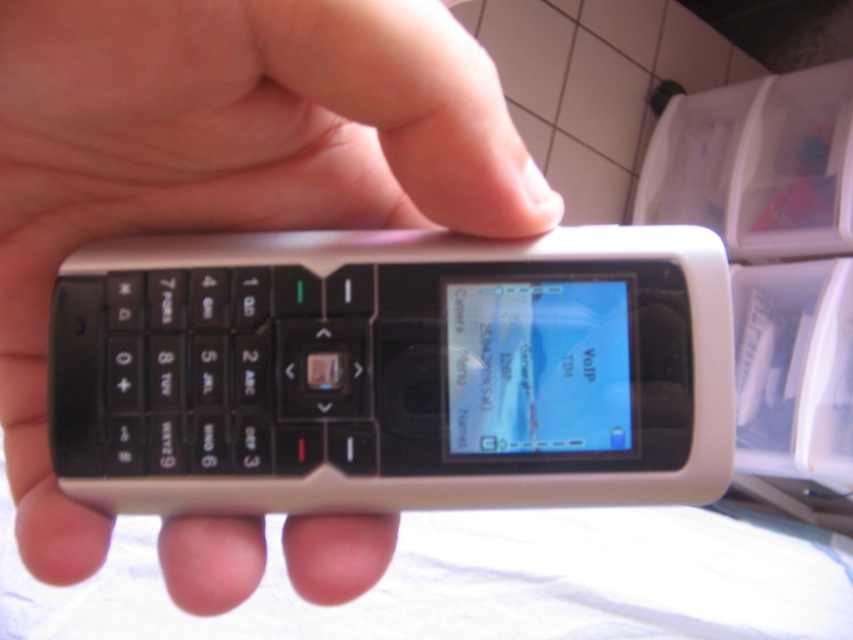
Is silver matte phone at center shorter than white matte phone at center?

Indeed, silver matte phone at center has a lesser height compared to white matte phone at center.

Is silver matte phone at center bigger than white matte phone at center?

No.

Is point (132, 324) closer to viewer compared to point (44, 529)?

No.

The width and height of the screenshot is (853, 640). I want to click on silver matte phone at center, so click(393, 371).